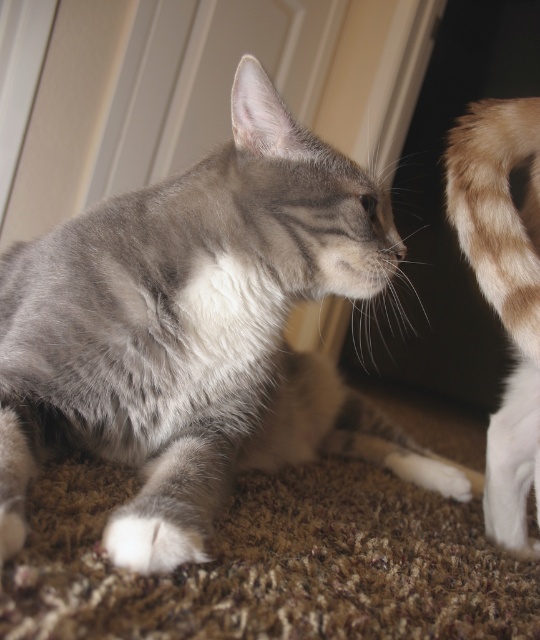
Question: Among these objects, which one is nearest to the camera?

Choices:
 (A) light brown fur tail at right
 (B) white soft fur paw at lower left
 (C) gray soft fur cat at center

Answer: (C)

Question: In this image, where is light brown fur tail at right located relative to white soft fur paw at lower left?

Choices:
 (A) above
 (B) below

Answer: (A)

Question: Which of the following is the closest to the observer?

Choices:
 (A) gray soft fur cat at center
 (B) white soft fur paw at lower left

Answer: (A)

Question: Does gray soft fur cat at center have a greater width compared to light brown fur tail at right?

Choices:
 (A) yes
 (B) no

Answer: (A)

Question: Can you confirm if gray soft fur cat at center is thinner than light brown fur tail at right?

Choices:
 (A) yes
 (B) no

Answer: (B)

Question: Based on their relative distances, which object is farther from the white soft fur paw at lower left?

Choices:
 (A) light brown fur tail at right
 (B) gray soft fur cat at center

Answer: (A)